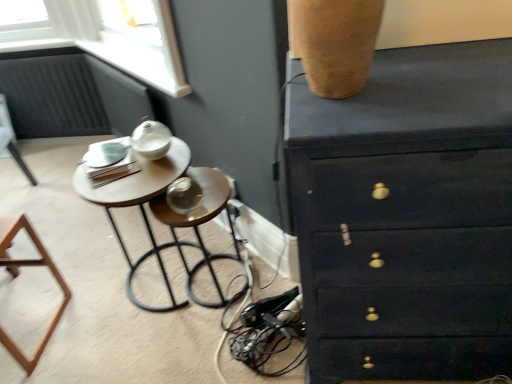
Question: Can you confirm if matte white lamp at upper left, the 1th furniture viewed from the left, is bigger than dark wood chest of drawers at upper right?

Choices:
 (A) no
 (B) yes

Answer: (A)

Question: From a real-world perspective, is matte white lamp at upper left, the 2th furniture from the bottom, physically below dark wood chest of drawers at upper right?

Choices:
 (A) no
 (B) yes

Answer: (B)

Question: Is matte white lamp at upper left, positioned as the first furniture in top-to-bottom order, behind dark wood chest of drawers at upper right?

Choices:
 (A) yes
 (B) no

Answer: (A)

Question: Considering the relative positions of matte white lamp at upper left, positioned as the second furniture in right-to-left order, and dark wood chest of drawers at upper right in the image provided, is matte white lamp at upper left, positioned as the second furniture in right-to-left order, in front of dark wood chest of drawers at upper right?

Choices:
 (A) yes
 (B) no

Answer: (B)

Question: Does matte white lamp at upper left, positioned as the first furniture in top-to-bottom order, have a smaller size compared to dark wood chest of drawers at upper right?

Choices:
 (A) yes
 (B) no

Answer: (A)

Question: From a real-world perspective, is matte white lamp at upper left, arranged as the first furniture when viewed from the back, physically above dark wood chest of drawers at upper right?

Choices:
 (A) no
 (B) yes

Answer: (A)

Question: Is wooden bar stool at center a part of dark wood chest of drawers at upper right?

Choices:
 (A) yes
 (B) no

Answer: (B)

Question: Can you confirm if dark wood chest of drawers at upper right is shorter than wooden bar stool at center?

Choices:
 (A) yes
 (B) no

Answer: (B)

Question: Is dark wood chest of drawers at upper right facing away from wooden bar stool at center?

Choices:
 (A) yes
 (B) no

Answer: (B)

Question: Is dark wood chest of drawers at upper right taller than wooden bar stool at center?

Choices:
 (A) no
 (B) yes

Answer: (B)

Question: From a real-world perspective, is dark wood chest of drawers at upper right below wooden bar stool at center?

Choices:
 (A) yes
 (B) no

Answer: (B)

Question: From the image's perspective, is dark wood chest of drawers at upper right over wooden bar stool at center?

Choices:
 (A) yes
 (B) no

Answer: (A)

Question: Is matte white lamp at upper left, the 2th furniture from the bottom, thinner than wooden bar stool at center?

Choices:
 (A) yes
 (B) no

Answer: (A)